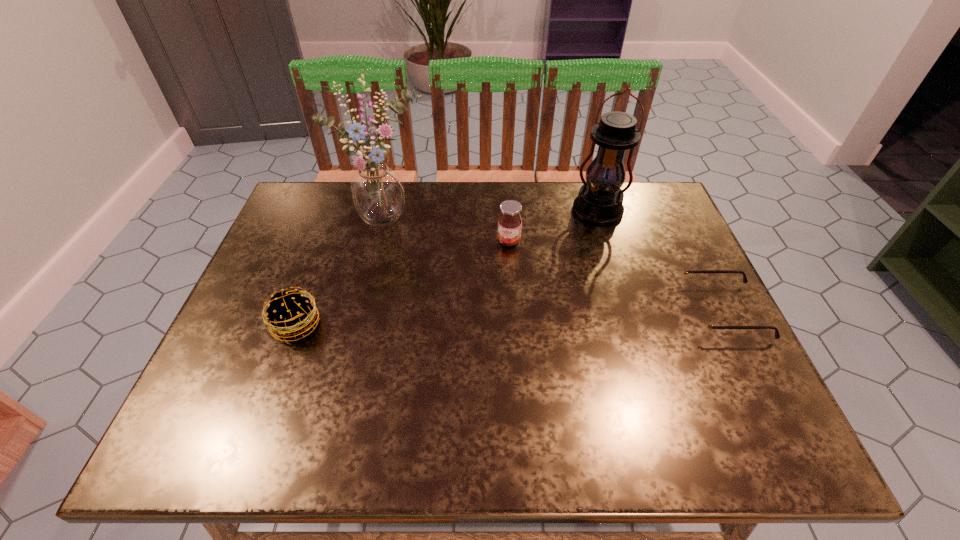
This screenshot has height=540, width=960. What are the coordinates of `free space between the third object from right to left and the rightmost object` in the screenshot? It's located at (615, 276).

Where is `vacant point located between the third shortest object and the shortest object`? vacant point located between the third shortest object and the shortest object is located at coordinates (615, 276).

Locate an element on the screen. This screenshot has height=540, width=960. free space between the patty and the fourth object from left to right is located at coordinates (447, 268).

Locate an element on the screen. free point between the bouquet and the patty is located at coordinates (341, 272).

Find the location of a particular element. the fourth closest object to the third tallest object is located at coordinates click(x=290, y=313).

Identify which object is the nearest to the third tallest object. Please provide its 2D coordinates. Your answer should be formatted as a tuple, i.e. [(x, y)], where the tuple contains the x and y coordinates of a point satisfying the conditions above.

[(600, 200)]

Where is `free region that satisfies the following two spatial constraints: 1. on the back side of the second tallest object; 2. on the left side of the bouquet`? free region that satisfies the following two spatial constraints: 1. on the back side of the second tallest object; 2. on the left side of the bouquet is located at coordinates (387, 211).

I want to click on vacant area in the image that satisfies the following two spatial constraints: 1. on the back side of the second shortest object; 2. at the hinge ends of the spectacles, so click(x=301, y=312).

The height and width of the screenshot is (540, 960). Find the location of `blank space that satisfies the following two spatial constraints: 1. on the front side of the shortest object; 2. at the hinge ends of the lantern`. blank space that satisfies the following two spatial constraints: 1. on the front side of the shortest object; 2. at the hinge ends of the lantern is located at coordinates (629, 312).